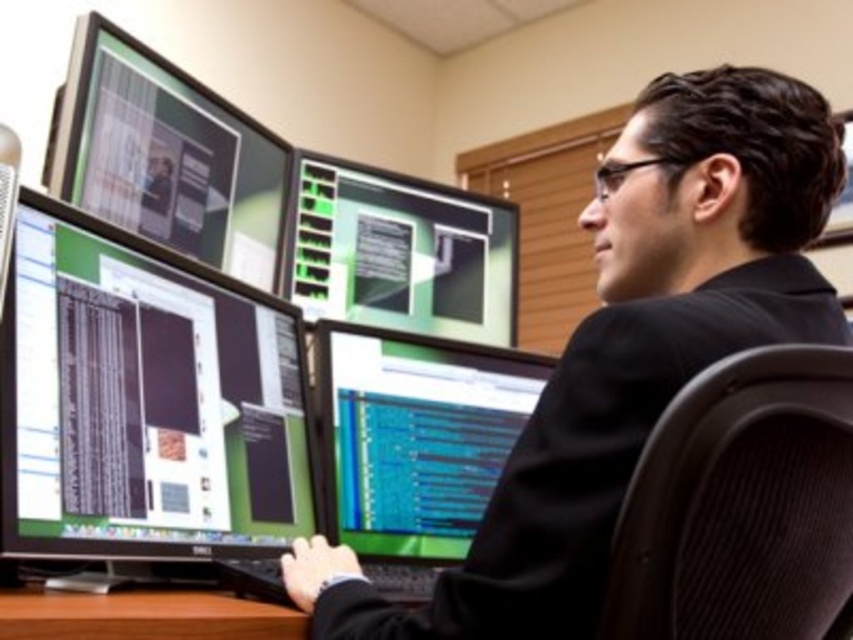
Question: Is matte black monitor at center further to the viewer compared to matte black monitor at upper left?

Choices:
 (A) yes
 (B) no

Answer: (A)

Question: Which object appears farthest from the camera in this image?

Choices:
 (A) black glossy suit at center
 (B) brown wood table at lower center
 (C) matte black monitor at center
 (D) matte black monitor at upper left

Answer: (C)

Question: Which point is farther from the camera taking this photo?

Choices:
 (A) (338, 218)
 (B) (15, 170)
 (C) (440, 522)

Answer: (A)

Question: Is black glossy suit at center above matte black monitor at center?

Choices:
 (A) no
 (B) yes

Answer: (B)

Question: Is matte black monitor at upper left thinner than black glossy monitor at left?

Choices:
 (A) no
 (B) yes

Answer: (A)

Question: Estimate the real-world distances between objects in this image. Which object is farther from the matte black monitor at center?

Choices:
 (A) green glossy monitor at center
 (B) matte black monitor at upper left
 (C) matte black monitor at left

Answer: (B)